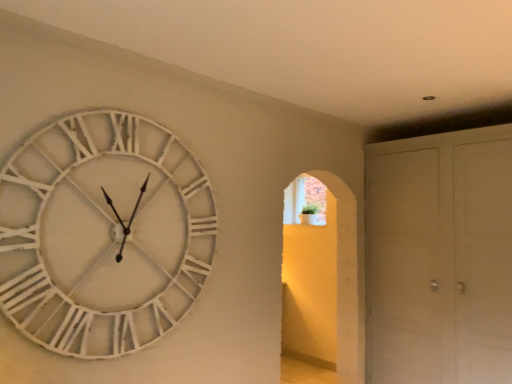
Question: From a real-world perspective, is white matte cabinet at right beneath white wooden clock at upper left?

Choices:
 (A) no
 (B) yes

Answer: (B)

Question: From the image's perspective, is white matte cabinet at right on top of white wooden clock at upper left?

Choices:
 (A) yes
 (B) no

Answer: (B)

Question: Is white matte cabinet at right outside white wooden clock at upper left?

Choices:
 (A) no
 (B) yes

Answer: (B)

Question: Is white matte cabinet at right behind white wooden clock at upper left?

Choices:
 (A) yes
 (B) no

Answer: (A)

Question: Can you confirm if white matte cabinet at right is thinner than white wooden clock at upper left?

Choices:
 (A) yes
 (B) no

Answer: (B)

Question: Are white matte cabinet at right and white wooden clock at upper left beside each other?

Choices:
 (A) no
 (B) yes

Answer: (A)

Question: Does white wooden clock at upper left have a lesser height compared to white matte cabinet at right?

Choices:
 (A) yes
 (B) no

Answer: (A)

Question: Is white matte cabinet at right inside white wooden clock at upper left?

Choices:
 (A) no
 (B) yes

Answer: (A)

Question: Can you confirm if white wooden clock at upper left is thinner than white matte cabinet at right?

Choices:
 (A) no
 (B) yes

Answer: (B)

Question: Is there a large distance between white wooden clock at upper left and white matte cabinet at right?

Choices:
 (A) yes
 (B) no

Answer: (A)

Question: Is white wooden clock at upper left taller than white matte cabinet at right?

Choices:
 (A) yes
 (B) no

Answer: (B)

Question: Is white wooden clock at upper left in contact with white matte cabinet at right?

Choices:
 (A) yes
 (B) no

Answer: (B)

Question: Considering the relative positions of white matte cabinet at right and white wooden clock at upper left in the image provided, is white matte cabinet at right to the left or to the right of white wooden clock at upper left?

Choices:
 (A) right
 (B) left

Answer: (A)